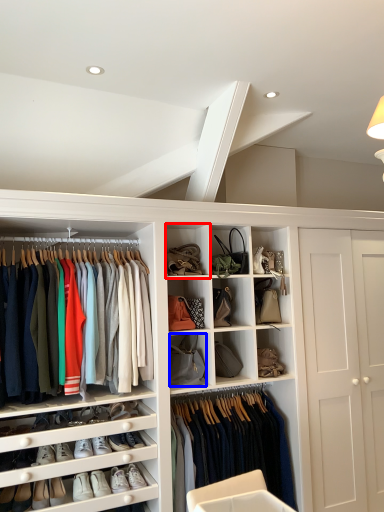
Question: Which object appears farthest to the camera in this image, cabinet (highlighted by a red box) or accessory (highlighted by a blue box)?

Choices:
 (A) cabinet
 (B) accessory

Answer: (B)